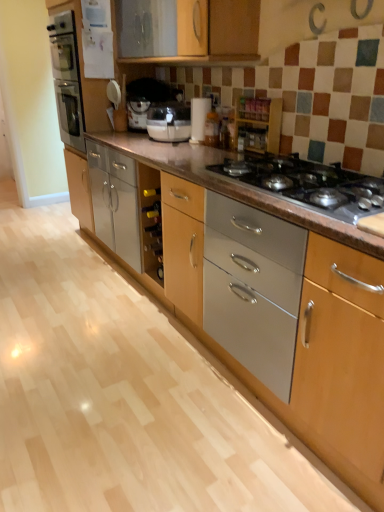
Question: Would you consider metallic gray gas stove at center to be distant from wooden spice rack at upper center?

Choices:
 (A) no
 (B) yes

Answer: (A)

Question: Could you tell me if metallic gray gas stove at center is turned towards wooden spice rack at upper center?

Choices:
 (A) no
 (B) yes

Answer: (A)

Question: Is metallic gray gas stove at center touching wooden spice rack at upper center?

Choices:
 (A) yes
 (B) no

Answer: (B)

Question: Considering the relative sizes of metallic gray gas stove at center and wooden spice rack at upper center in the image provided, is metallic gray gas stove at center shorter than wooden spice rack at upper center?

Choices:
 (A) no
 (B) yes

Answer: (B)

Question: Does metallic gray gas stove at center have a larger size compared to wooden spice rack at upper center?

Choices:
 (A) yes
 (B) no

Answer: (A)

Question: Is wooden spice rack at upper center wider or thinner than metallic gray gas stove at center?

Choices:
 (A) thin
 (B) wide

Answer: (A)

Question: From a real-world perspective, relative to metallic gray gas stove at center, is wooden spice rack at upper center vertically above or below?

Choices:
 (A) below
 (B) above

Answer: (B)

Question: Considering the positions of wooden spice rack at upper center and metallic gray gas stove at center in the image, is wooden spice rack at upper center taller or shorter than metallic gray gas stove at center?

Choices:
 (A) short
 (B) tall

Answer: (B)

Question: Is point (253, 126) closer or farther from the camera than point (362, 179)?

Choices:
 (A) farther
 (B) closer

Answer: (A)

Question: Is wooden spice rack at upper center inside the boundaries of white paper towel holder at center, or outside?

Choices:
 (A) outside
 (B) inside

Answer: (A)

Question: Considering their positions, is wooden spice rack at upper center located in front of or behind white paper towel holder at center?

Choices:
 (A) behind
 (B) front

Answer: (B)

Question: From a real-world perspective, relative to white paper towel holder at center, is wooden spice rack at upper center vertically above or below?

Choices:
 (A) above
 (B) below

Answer: (B)

Question: In terms of height, does wooden spice rack at upper center look taller or shorter compared to white paper towel holder at center?

Choices:
 (A) tall
 (B) short

Answer: (B)

Question: In the image, is white paper towel holder at center on the left side or the right side of wooden spice rack at upper center?

Choices:
 (A) right
 (B) left

Answer: (B)

Question: Is white paper towel holder at center situated inside wooden spice rack at upper center or outside?

Choices:
 (A) outside
 (B) inside

Answer: (A)